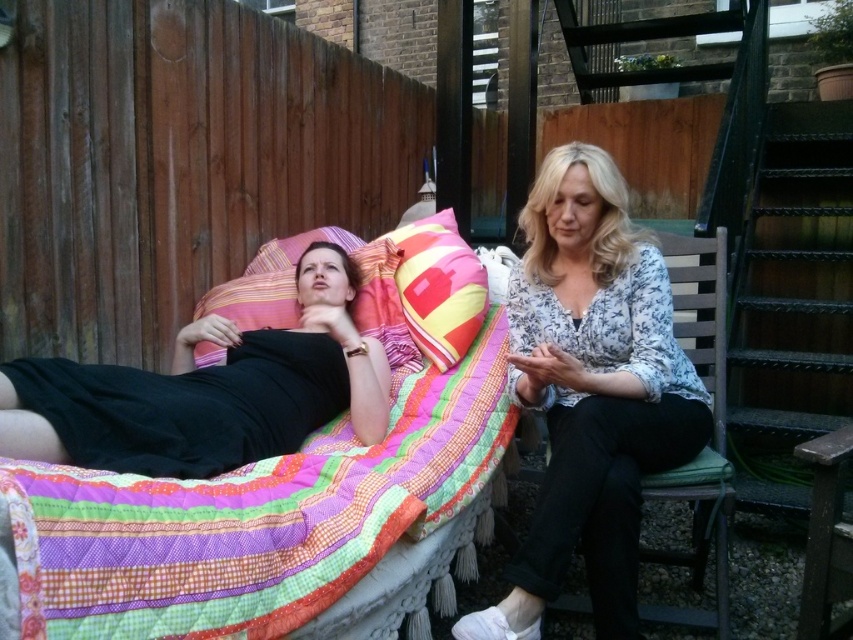
You are designing a seating arrangement and need to place both the striped fabric pillow at upper left and the multicolored quilted pillow at center on a shelf. Which pillow should you place first if you want the taller one to be in the back?

The multicolored quilted pillow at center is taller than the striped fabric pillow at upper left, so you should place the multicolored quilted pillow at center first in the back to ensure proper arrangement.

You are standing in the outdoor area and want to hand a book to the person wearing the floral blouse at center. Which direction should you approach from relative to the black matte dress at center?

The floral blouse at center is closer to you than the black matte dress at center, so you should approach from the direction of the floral blouse at center towards the black matte dress at center.

You are standing in front of the two people in the image. You want to throw a ball to the person on the right but avoid hitting the person on the left. Which point, point (332, 445) or point (262, 264), should you aim for to ensure the ball reaches the right person without hitting the left one?

You should aim for point (262, 264) because it is farther from the viewer than point (332, 445). This way, the ball will pass behind the left person and reach the right person safely.